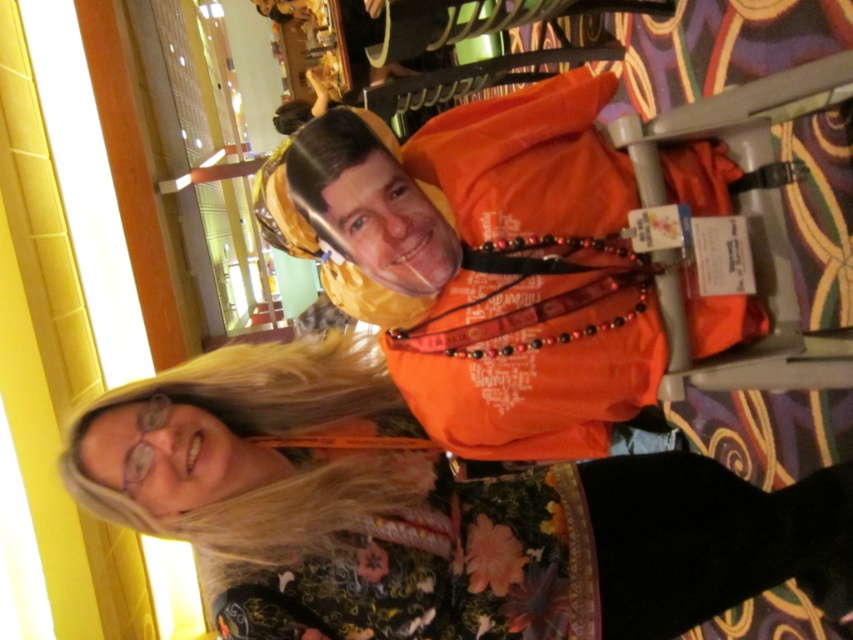
Can you confirm if floral-patterned dress at center is shorter than orange fabric at center?

Yes, floral-patterned dress at center is shorter than orange fabric at center.

Identify the location of floral-patterned dress at center. This screenshot has width=853, height=640. (424, 512).